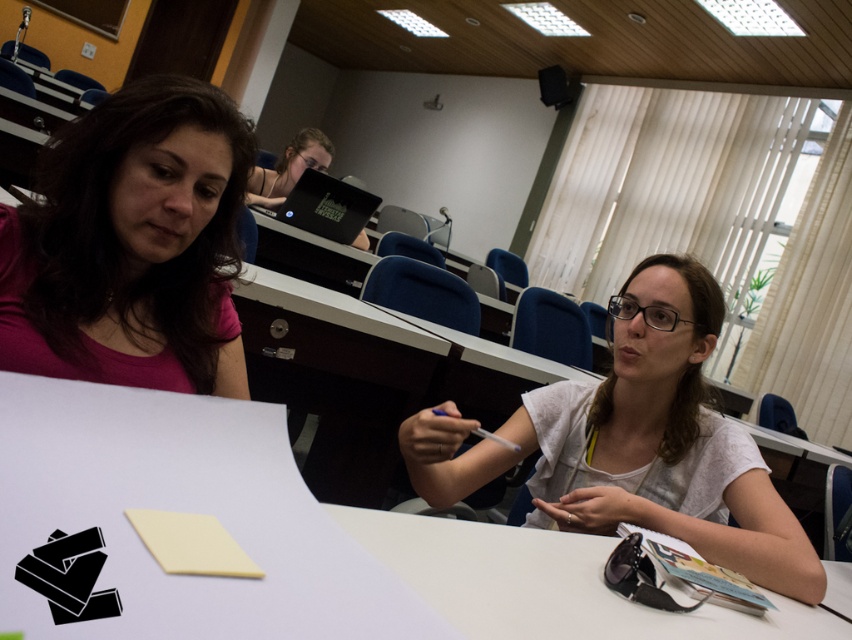
Question: Which object is positioned closest to the white matte shirt at center?

Choices:
 (A) white matte table at center
 (B) pink matte shirt at upper left
 (C) matte black laptop at upper center

Answer: (A)

Question: Is white matte shirt at center wider than black matte laptop at upper center?

Choices:
 (A) yes
 (B) no

Answer: (A)

Question: Can you confirm if pink matte shirt at upper left is thinner than black matte laptop at upper center?

Choices:
 (A) yes
 (B) no

Answer: (A)

Question: Which point is closer to the camera?

Choices:
 (A) (695, 314)
 (B) (278, 189)
 (C) (275, 627)

Answer: (C)

Question: Which point is farther from the camera taking this photo?

Choices:
 (A) (56, 230)
 (B) (269, 177)

Answer: (B)

Question: Can you confirm if pink matte shirt at upper left is wider than white matte shirt at center?

Choices:
 (A) yes
 (B) no

Answer: (B)